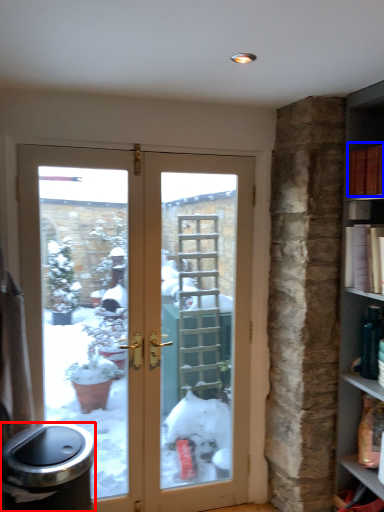
Question: Which point is closer to the camera, garbage (highlighted by a red box) or book (highlighted by a blue box)?

Choices:
 (A) garbage
 (B) book

Answer: (A)